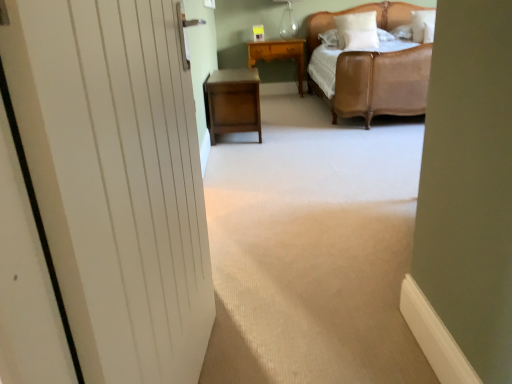
Question: Can you confirm if wooden nightstand at center, positioned as the first nightstand in bottom-to-top order, is bigger than yellow wood nightstand at center, positioned as the 2th nightstand in bottom-to-top order?

Choices:
 (A) yes
 (B) no

Answer: (A)

Question: From a real-world perspective, is wooden nightstand at center, the 2th nightstand positioned from the top, on yellow wood nightstand at center, positioned as the 2th nightstand in bottom-to-top order?

Choices:
 (A) yes
 (B) no

Answer: (B)

Question: Can you confirm if wooden nightstand at center, the 2th nightstand positioned from the top, is positioned to the left of yellow wood nightstand at center, which ranks as the second nightstand in front-to-back order?

Choices:
 (A) yes
 (B) no

Answer: (A)

Question: Can you confirm if wooden nightstand at center, positioned as the first nightstand in bottom-to-top order, is thinner than yellow wood nightstand at center, arranged as the first nightstand when viewed from the back?

Choices:
 (A) no
 (B) yes

Answer: (A)

Question: Is yellow wood nightstand at center, positioned as the 2th nightstand in bottom-to-top order, inside wooden nightstand at center, arranged as the second nightstand when viewed from the back?

Choices:
 (A) no
 (B) yes

Answer: (A)

Question: Is wooden nightstand at center, the 2th nightstand positioned from the top, facing away from yellow wood nightstand at center, the 1th nightstand positioned from the top?

Choices:
 (A) no
 (B) yes

Answer: (A)

Question: Is white soft pillow at upper right, positioned as the third pillow in right-to-left order, inside wooden nightstand at center, arranged as the second nightstand when viewed from the back?

Choices:
 (A) no
 (B) yes

Answer: (A)

Question: From the image's perspective, is wooden nightstand at center, the first nightstand in the front-to-back sequence, under white soft pillow at upper right, positioned as the third pillow in right-to-left order?

Choices:
 (A) yes
 (B) no

Answer: (A)

Question: Does wooden nightstand at center, positioned as the first nightstand in bottom-to-top order, have a lesser width compared to white soft pillow at upper right, marked as the 1th pillow in a left-to-right arrangement?

Choices:
 (A) yes
 (B) no

Answer: (B)

Question: Can you confirm if wooden nightstand at center, positioned as the first nightstand in bottom-to-top order, is positioned to the right of white soft pillow at upper right, marked as the 1th pillow in a left-to-right arrangement?

Choices:
 (A) no
 (B) yes

Answer: (A)

Question: Can you confirm if wooden nightstand at center, arranged as the second nightstand when viewed from the back, is wider than white soft pillow at upper right, positioned as the third pillow in right-to-left order?

Choices:
 (A) no
 (B) yes

Answer: (B)

Question: Does wooden nightstand at center, arranged as the second nightstand when viewed from the back, appear on the left side of white soft pillow at upper right, positioned as the third pillow in right-to-left order?

Choices:
 (A) yes
 (B) no

Answer: (A)

Question: Can you confirm if white soft pillow at upper right, the third pillow from the left, is positioned to the right of white matte door at left?

Choices:
 (A) no
 (B) yes

Answer: (B)